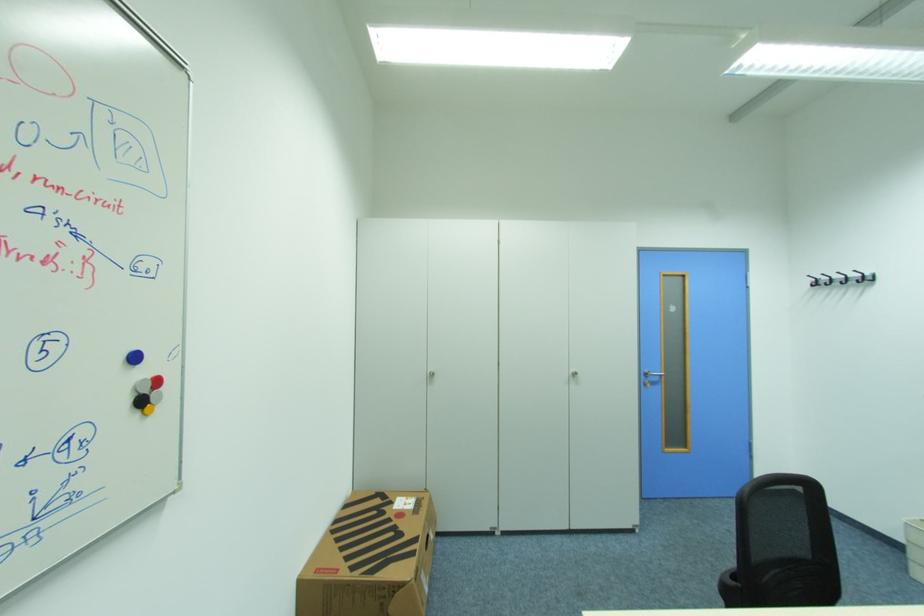
Where would you lift the yellow whiteboard magnet? Please return your answer as a coordinate pair (x, y).

(148, 410)